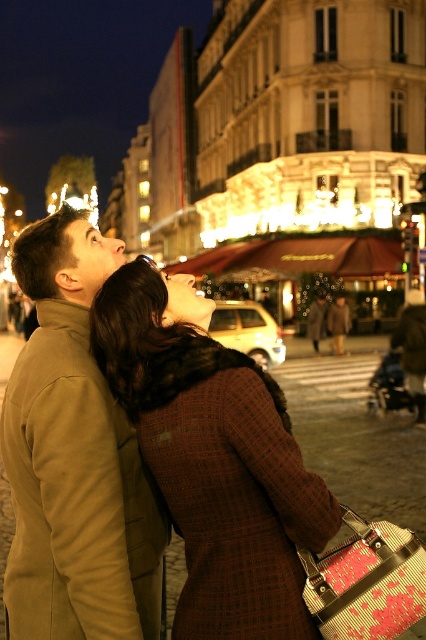
Does point (282, 586) come closer to viewer compared to point (331, 326)?

Yes, point (282, 586) is in front of point (331, 326).

Is plaid wool coat at center smaller than brown wool coat at center?

Actually, plaid wool coat at center might be larger than brown wool coat at center.

This screenshot has height=640, width=426. Find the location of `plaid wool coat at center`. plaid wool coat at center is located at coordinates (215, 461).

Is point (268, 600) positioned after point (126, 548)?

No, (268, 600) is in front of (126, 548).

What are the coordinates of `plaid wool coat at center` in the screenshot? It's located at (215, 461).

Is point (66, 483) behind point (336, 304)?

That is False.

Which is more to the right, tan wool coat at left or brown wool coat at center?

From the viewer's perspective, brown wool coat at center appears more on the right side.

The height and width of the screenshot is (640, 426). Identify the location of tan wool coat at left. (74, 458).